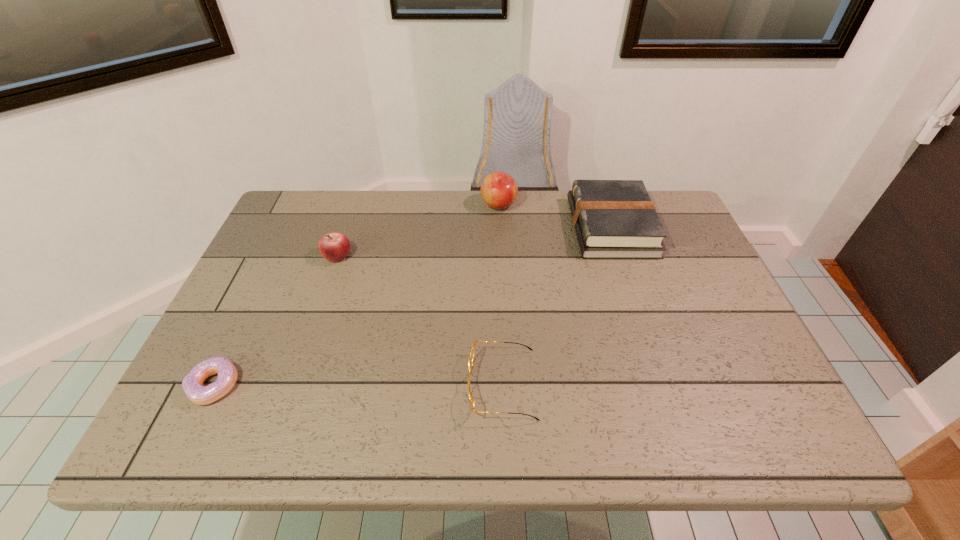
At what (x,y) coordinates should I click in order to perform the action: click on doughnut that is at the near edge. Please return your answer as a coordinate pair (x, y). The width and height of the screenshot is (960, 540). Looking at the image, I should click on (192, 384).

The height and width of the screenshot is (540, 960). I want to click on object that is at the left edge, so click(x=192, y=384).

Locate an element on the screen. This screenshot has width=960, height=540. object that is at the right edge is located at coordinates (614, 219).

What are the coordinates of `object situated at the near left corner` in the screenshot? It's located at (192, 384).

This screenshot has height=540, width=960. In order to click on object that is positioned at the far right corner in this screenshot , I will do `click(614, 219)`.

Image resolution: width=960 pixels, height=540 pixels. I want to click on vacant space at the far edge of the desktop, so click(x=471, y=207).

Locate an element on the screen. This screenshot has width=960, height=540. free space at the near edge of the desktop is located at coordinates (312, 421).

In the image, there is a desktop. What are the coordinates of `vacant space at the left edge` in the screenshot? It's located at pos(302,264).

Where is `blank area at the right edge`? blank area at the right edge is located at coordinates (672, 281).

Where is `blank area at the far right corner`? Image resolution: width=960 pixels, height=540 pixels. blank area at the far right corner is located at coordinates [684, 233].